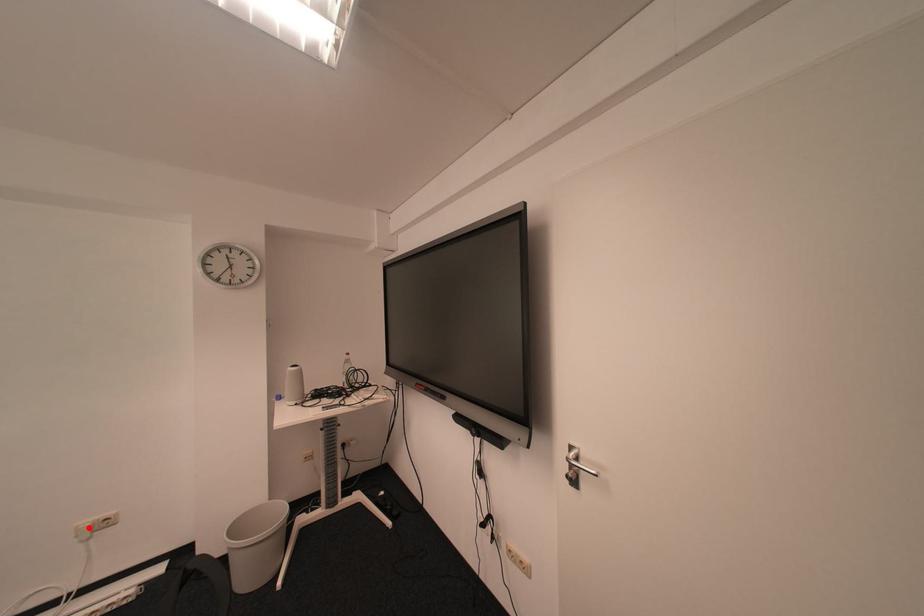
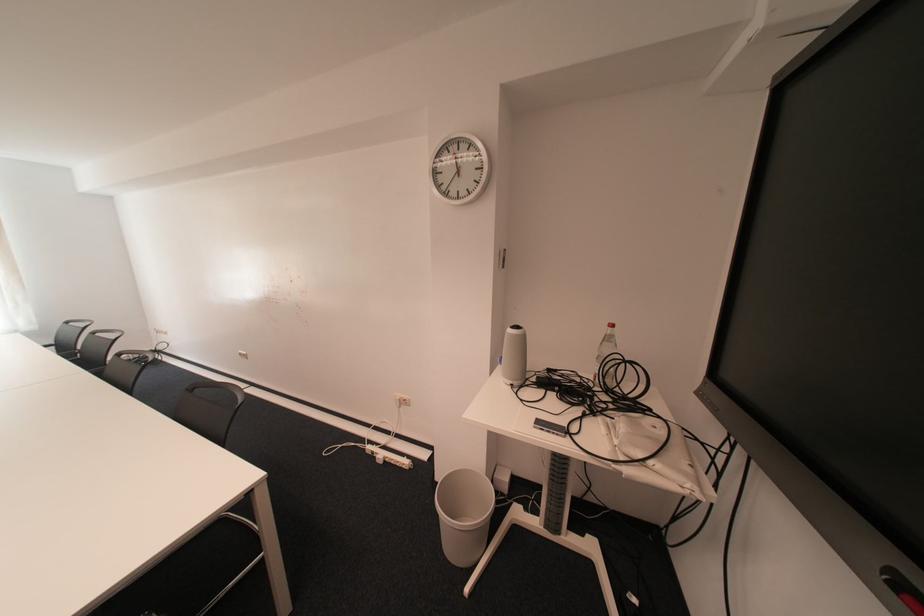
Locate, in the second image, the point that corresponds to the highlighted location in the first image.

(407, 397)